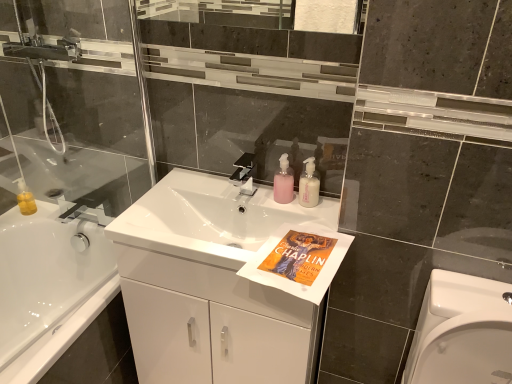
Question: From a real-world perspective, is transparent glass shower door at left on pink matte soap dispenser at center, marked as the 2th toiletry in a left-to-right arrangement?

Choices:
 (A) yes
 (B) no

Answer: (A)

Question: Is pink matte soap dispenser at center, marked as the 2th toiletry in a left-to-right arrangement, a part of transparent glass shower door at left?

Choices:
 (A) yes
 (B) no

Answer: (B)

Question: Can you confirm if transparent glass shower door at left is wider than pink matte soap dispenser at center, marked as the 2th toiletry in a left-to-right arrangement?

Choices:
 (A) yes
 (B) no

Answer: (A)

Question: From the image's perspective, would you say transparent glass shower door at left is positioned over pink matte soap dispenser at center, marked as the 2th toiletry in a left-to-right arrangement?

Choices:
 (A) no
 (B) yes

Answer: (B)

Question: Is transparent glass shower door at left next to pink matte soap dispenser at center, marked as the 2th toiletry in a left-to-right arrangement, and touching it?

Choices:
 (A) yes
 (B) no

Answer: (B)

Question: Would you say pink matte soap dispenser at center, which ranks as the first toiletry in right-to-left order, is inside or outside pink translucent pump bottle at center, which is counted as the first toiletry, starting from the left?

Choices:
 (A) outside
 (B) inside

Answer: (A)

Question: From the image's perspective, relative to pink translucent pump bottle at center, which is counted as the first toiletry, starting from the left, is pink matte soap dispenser at center, marked as the 2th toiletry in a left-to-right arrangement, above or below?

Choices:
 (A) above
 (B) below

Answer: (B)

Question: Is point (300, 187) positioned closer to the camera than point (282, 200)?

Choices:
 (A) farther
 (B) closer

Answer: (B)

Question: In terms of width, does pink matte soap dispenser at center, which ranks as the first toiletry in right-to-left order, look wider or thinner when compared to pink translucent pump bottle at center, the 2th toiletry in the right-to-left sequence?

Choices:
 (A) thin
 (B) wide

Answer: (A)

Question: In terms of size, does satin nickel faucet at center appear bigger or smaller than pink translucent pump bottle at center, which is counted as the first toiletry, starting from the left?

Choices:
 (A) big
 (B) small

Answer: (A)

Question: Which is correct: satin nickel faucet at center is inside pink translucent pump bottle at center, the 2th toiletry in the right-to-left sequence, or outside of it?

Choices:
 (A) inside
 (B) outside

Answer: (B)

Question: Is satin nickel faucet at center to the left or to the right of pink translucent pump bottle at center, the 2th toiletry in the right-to-left sequence, in the image?

Choices:
 (A) left
 (B) right

Answer: (A)

Question: Is point (251, 175) positioned closer to the camera than point (279, 198)?

Choices:
 (A) farther
 (B) closer

Answer: (A)

Question: Is satin nickel faucet at center in front of or behind white glossy sink at center in the image?

Choices:
 (A) behind
 (B) front

Answer: (A)

Question: Is satin nickel faucet at center to the left or to the right of white glossy sink at center in the image?

Choices:
 (A) right
 (B) left

Answer: (A)